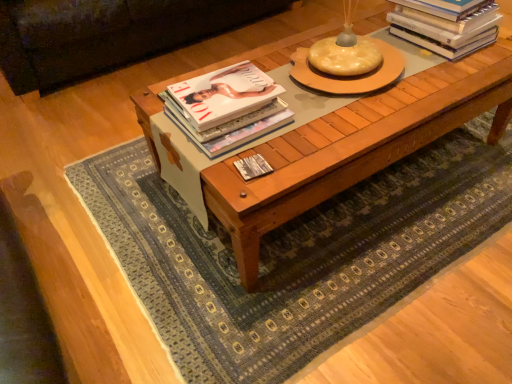
Identify the location of free space behind white glossy book at center, the third book viewed from the top. The image size is (512, 384). 264,144.